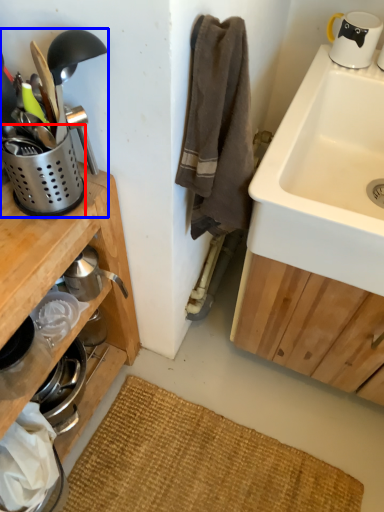
Question: Which object appears farthest to the camera in this image, appliance (highlighted by a red box) or appliance (highlighted by a blue box)?

Choices:
 (A) appliance
 (B) appliance

Answer: (A)